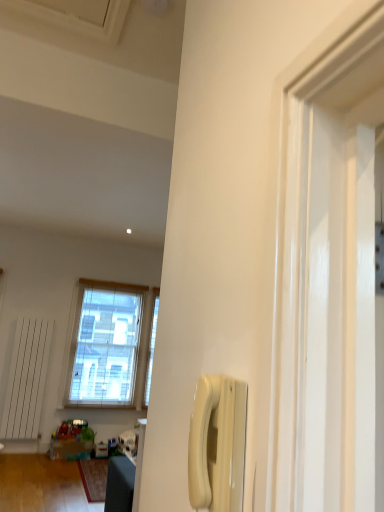
Question: Are clear glass window at center and translucent plastic toys at lower left making contact?

Choices:
 (A) no
 (B) yes

Answer: (A)

Question: Considering the relative sizes of clear glass window at center and translucent plastic toys at lower left in the image provided, is clear glass window at center wider than translucent plastic toys at lower left?

Choices:
 (A) yes
 (B) no

Answer: (B)

Question: From a real-world perspective, is clear glass window at center located beneath translucent plastic toys at lower left?

Choices:
 (A) yes
 (B) no

Answer: (B)

Question: Is clear glass window at center located outside translucent plastic toys at lower left?

Choices:
 (A) no
 (B) yes

Answer: (B)

Question: From a real-world perspective, does clear glass window at center stand above translucent plastic toys at lower left?

Choices:
 (A) yes
 (B) no

Answer: (A)

Question: From the image's perspective, is clear glass window at center located above translucent plastic toys at lower left?

Choices:
 (A) no
 (B) yes

Answer: (B)

Question: Does white plastic phone at center-right have a larger size compared to clear glass window at center?

Choices:
 (A) yes
 (B) no

Answer: (B)

Question: Can you confirm if white plastic phone at center-right is wider than clear glass window at center?

Choices:
 (A) no
 (B) yes

Answer: (A)

Question: From the image's perspective, is white plastic phone at center-right located above clear glass window at center?

Choices:
 (A) no
 (B) yes

Answer: (B)

Question: Is white plastic phone at center-right smaller than clear glass window at center?

Choices:
 (A) no
 (B) yes

Answer: (B)

Question: Could clear glass window at center be considered to be inside white plastic phone at center-right?

Choices:
 (A) no
 (B) yes

Answer: (A)

Question: Are white plastic phone at center-right and clear glass window at center located far from each other?

Choices:
 (A) no
 (B) yes

Answer: (B)

Question: Is white plastic phone at center-right at the left side of translucent plastic toys at lower left?

Choices:
 (A) yes
 (B) no

Answer: (B)